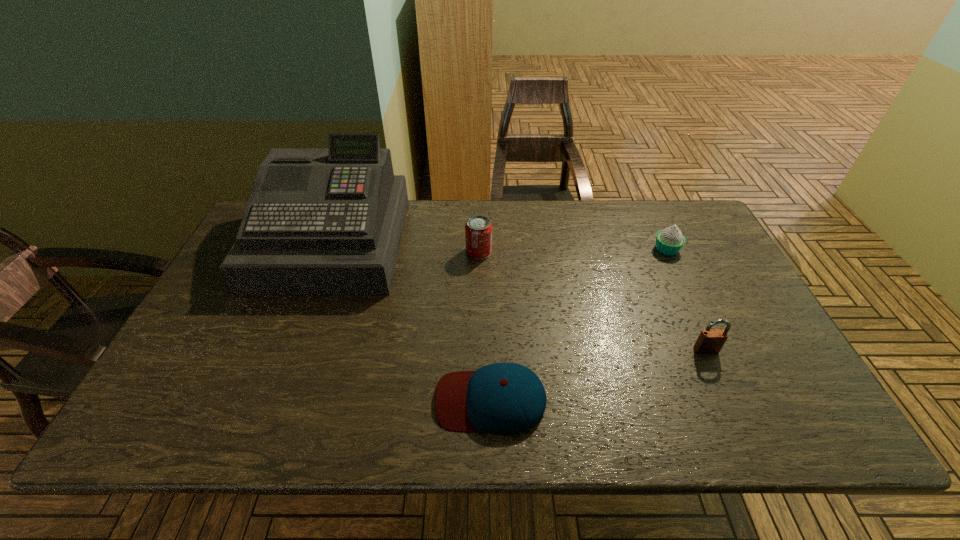
At what (x,y) coordinates should I click in order to perform the action: click on free spot located 0.130m on the back of the fourth tallest object. Please return your answer as a coordinate pair (x, y). The image size is (960, 540). Looking at the image, I should click on (651, 215).

The width and height of the screenshot is (960, 540). I want to click on free space located 0.190m with the bill of the baseball cap facing forward, so click(x=349, y=400).

You are a GUI agent. You are given a task and a screenshot of the screen. Output one action in this format:
    pyautogui.click(x=<x>, y=<y>)
    Task: Click on the vacant region located 0.290m with the bill of the baseball cap facing forward
    The width and height of the screenshot is (960, 540).
    Given the screenshot: What is the action you would take?
    pyautogui.click(x=304, y=400)

This screenshot has width=960, height=540. In order to click on free location located with the bill of the baseball cap facing forward in this screenshot , I will do `click(332, 400)`.

At what (x,y) coordinates should I click in order to perform the action: click on cash register that is at the far edge. Please return your answer as a coordinate pair (x, y). Looking at the image, I should click on (329, 221).

The image size is (960, 540). I want to click on can that is at the far edge, so click(x=478, y=229).

Identify the location of cupcake that is positioned at the far edge. (669, 241).

Where is `object located at the near edge`? The width and height of the screenshot is (960, 540). object located at the near edge is located at coordinates (502, 398).

I want to click on object at the left edge, so click(x=329, y=221).

Image resolution: width=960 pixels, height=540 pixels. Identify the location of padlock at the right edge. (710, 341).